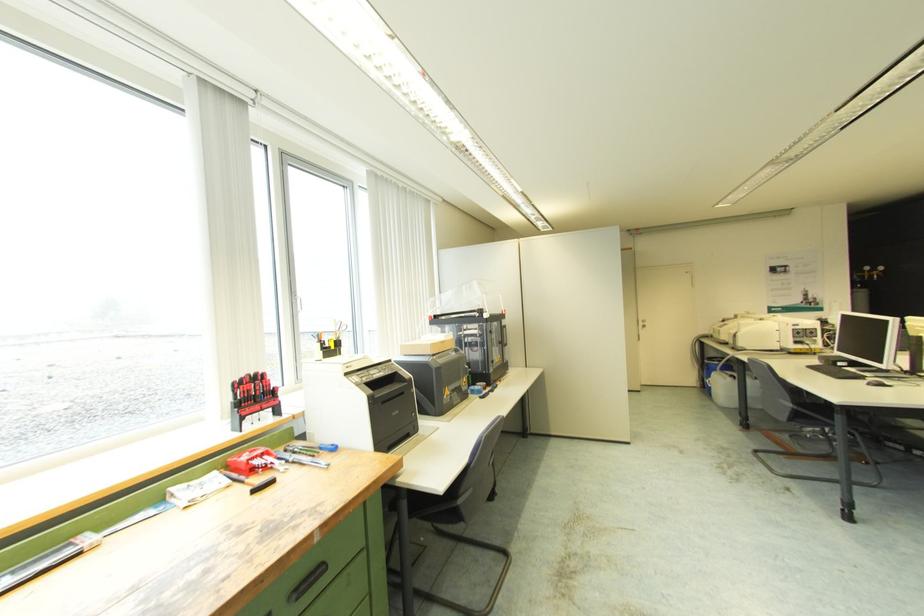
The height and width of the screenshot is (616, 924). I want to click on black chair armrest, so click(x=441, y=506).